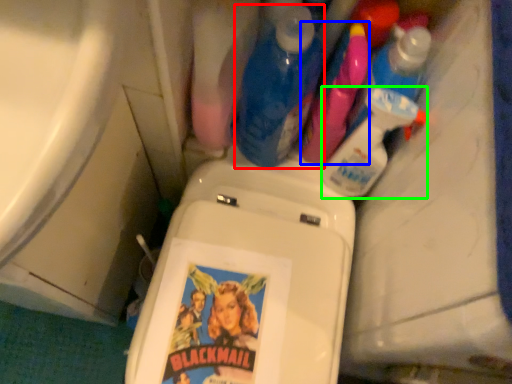
Question: Which object is positioned farthest from cleaning product (highlighted by a red box)? Select from cleaning product (highlighted by a blue box) and cleaning product (highlighted by a green box).

Choices:
 (A) cleaning product
 (B) cleaning product

Answer: (B)